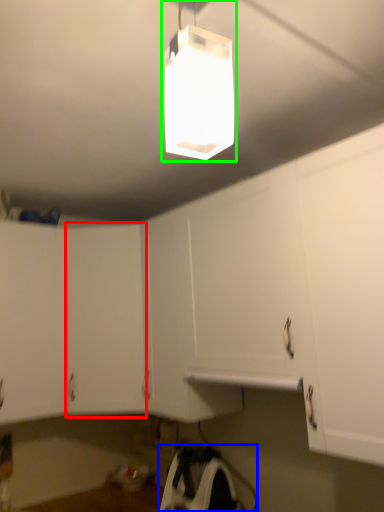
Question: Which object is positioned closest to cabinetry (highlighted by a red box)? Select from appliance (highlighted by a blue box) and lamp (highlighted by a green box).

Choices:
 (A) appliance
 (B) lamp

Answer: (A)